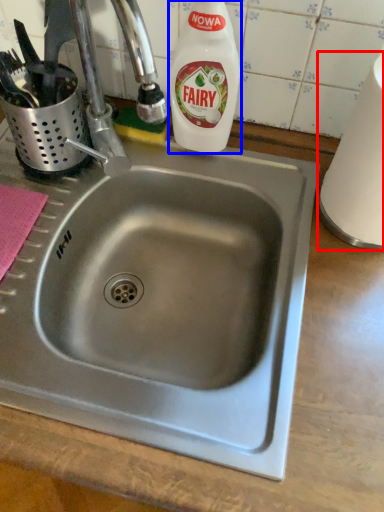
Question: Which of the following is the closest to the observer, paper towel (highlighted by a red box) or cleaning product (highlighted by a blue box)?

Choices:
 (A) paper towel
 (B) cleaning product

Answer: (A)